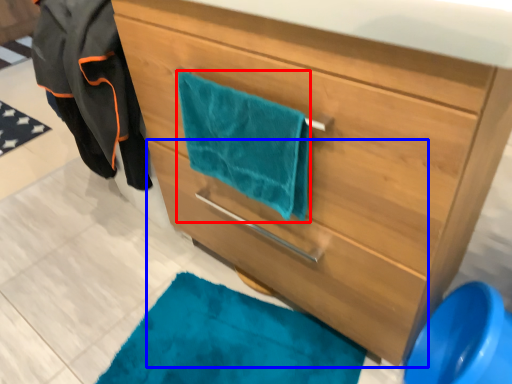
Question: Which point is further to the camera, beach towel (highlighted by a red box) or drawer (highlighted by a blue box)?

Choices:
 (A) beach towel
 (B) drawer

Answer: (A)